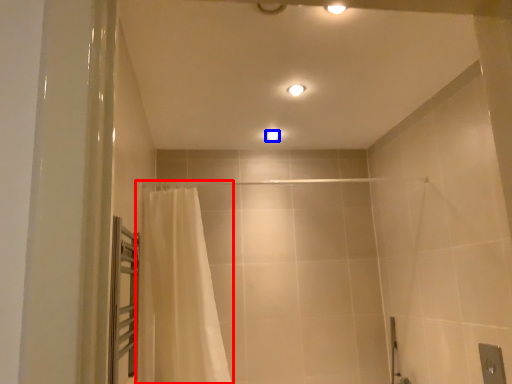
Question: Which object is closer to the camera taking this photo, curtain (highlighted by a red box) or light fixture (highlighted by a blue box)?

Choices:
 (A) curtain
 (B) light fixture

Answer: (A)